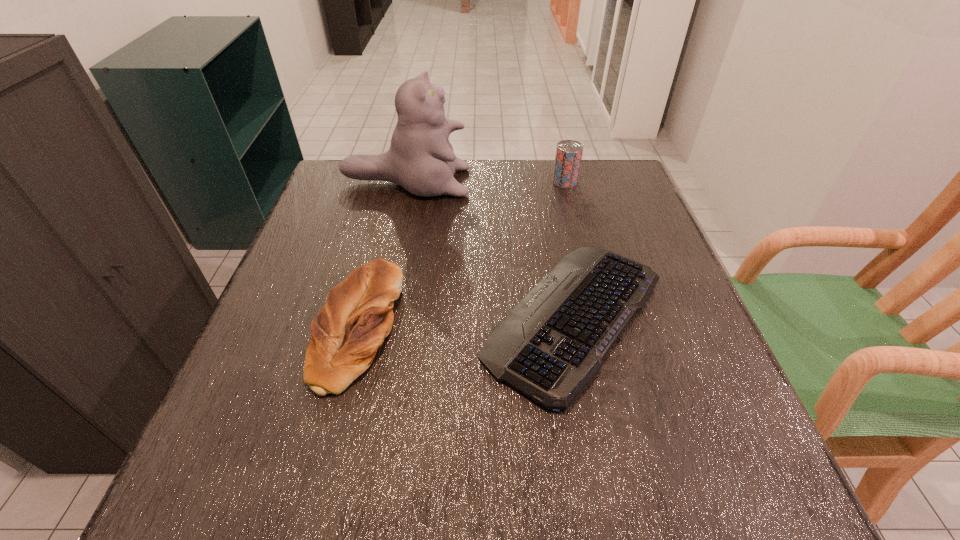
Locate an element on the screen. This screenshot has height=540, width=960. free space between the second tallest object and the second shortest object is located at coordinates (461, 254).

The image size is (960, 540). Identify the location of free space between the tallest object and the second shortest object. (381, 254).

Find the location of a particular element. The image size is (960, 540). empty space between the tallest object and the shortest object is located at coordinates (491, 249).

Image resolution: width=960 pixels, height=540 pixels. Find the location of `object that is the second closest one to the cat`. object that is the second closest one to the cat is located at coordinates (568, 156).

I want to click on object that is the second closest to the cat, so click(x=568, y=156).

Find the location of a particular element. The image size is (960, 540). free location that satisfies the following two spatial constraints: 1. on the back side of the beer can; 2. on the left side of the bread is located at coordinates (394, 182).

I want to click on vacant space that satisfies the following two spatial constraints: 1. on the face of the cat; 2. on the front side of the bread, so click(x=374, y=327).

At what (x,y) coordinates should I click in order to perform the action: click on free space that satisfies the following two spatial constraints: 1. on the back side of the computer keyboard; 2. on the right side of the second tallest object. Please return your answer as a coordinate pair (x, y). Image resolution: width=960 pixels, height=540 pixels. Looking at the image, I should click on (547, 182).